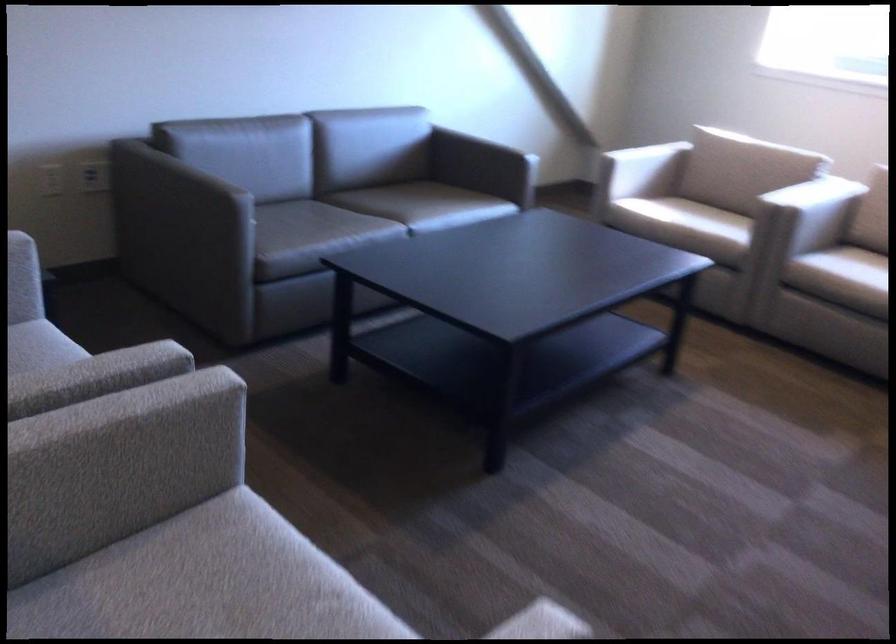
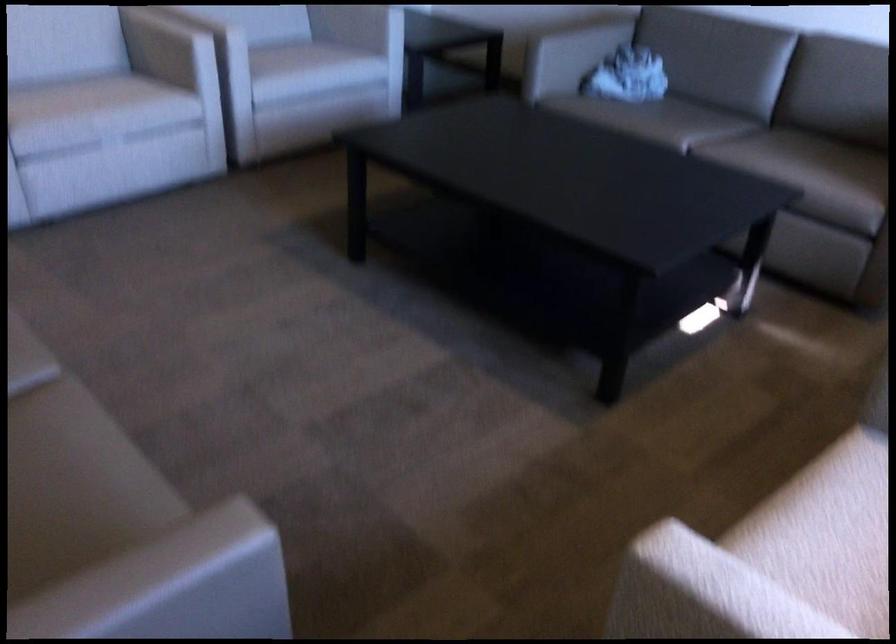
Where in the second image is the point corresponding to point 346,205 from the first image?

(714, 127)